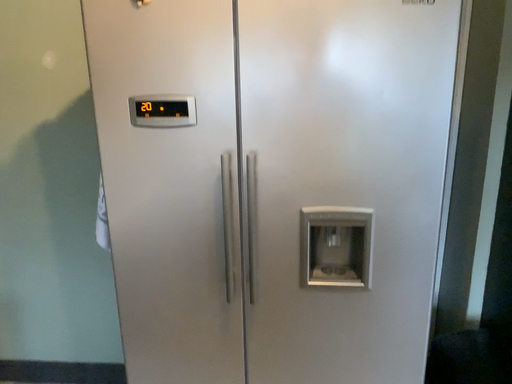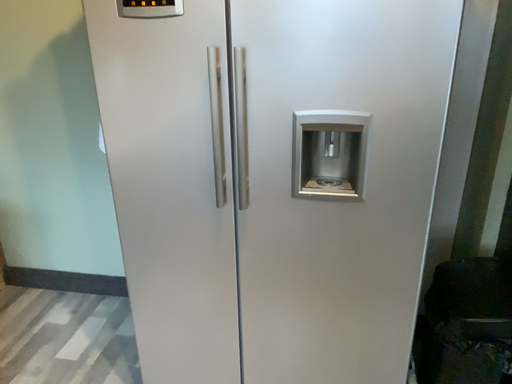
Question: How did the camera likely rotate when shooting the video?

Choices:
 (A) rotated right
 (B) rotated left

Answer: (B)